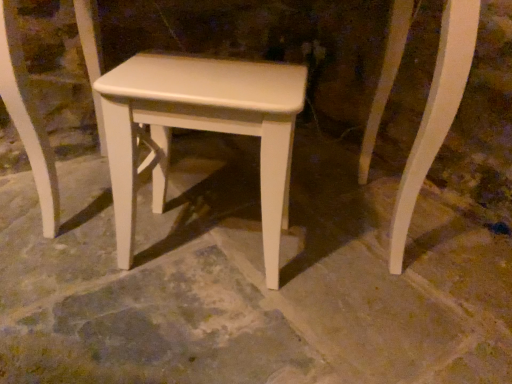
Locate an element on the screen. space that is in front of white matte stool at center is located at coordinates (204, 328).